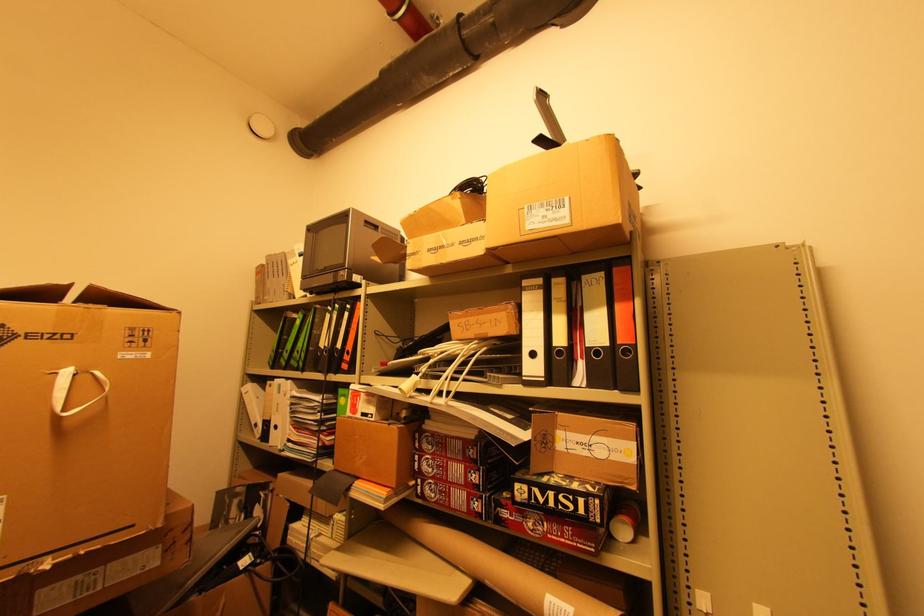
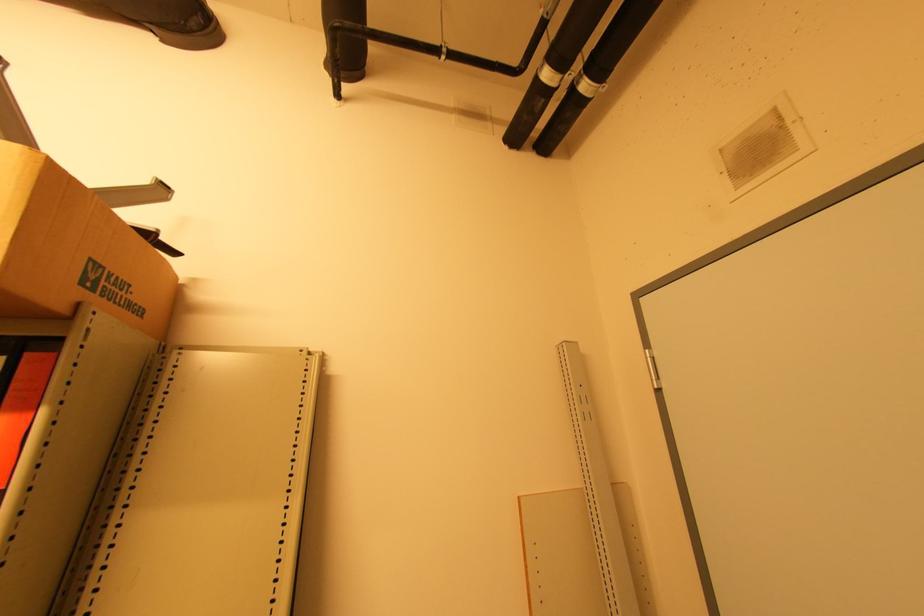
The point at (565,26) is marked in the first image. Where is the corresponding point in the second image?

(165, 42)